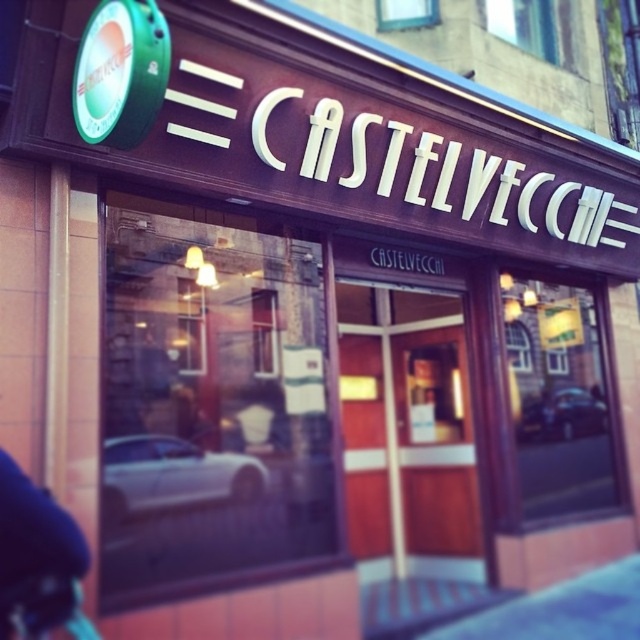
You are a delivery person standing between the white glossy car at lower left and the shiny silver car at center. You need to unload a package that requires 3 meters of space to open the side door. Can you safely open the side door here?

The distance between the white glossy car at lower left and the shiny silver car at center is 2.56 meters, which is less than the required 3 meters. Therefore, you cannot safely open the side door here.

You are standing in front of the restaurant and see the white glossy car at lower left and the shiny silver car at center. Which car is closer to the left side of the restaurant?

The white glossy car at lower left is closer to the left side of the restaurant because it is positioned on the left side of the shiny silver car at center.